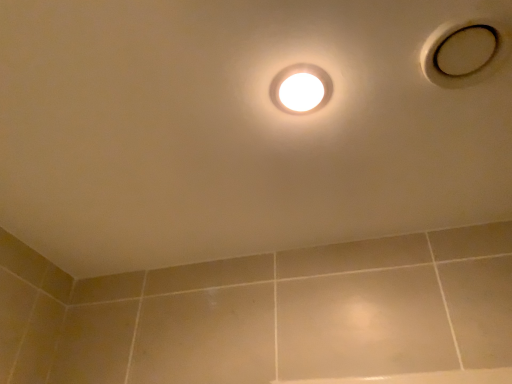
The image size is (512, 384). What are the coordinates of `white matte hole at upper right` in the screenshot? It's located at (463, 53).

The image size is (512, 384). What do you see at coordinates (463, 53) in the screenshot?
I see `white matte hole at upper right` at bounding box center [463, 53].

What is the approximate height of white matte hole at upper right?

The height of white matte hole at upper right is 1.03 inches.

Measure the distance between white glossy droplight at center and camera.

white glossy droplight at center is 26.93 inches away from camera.

In order to click on white glossy droplight at center in this screenshot , I will do `click(301, 89)`.

What do you see at coordinates (301, 89) in the screenshot? I see `white glossy droplight at center` at bounding box center [301, 89].

This screenshot has width=512, height=384. Find the location of `white matte hole at upper right`. white matte hole at upper right is located at coordinates (463, 53).

Is white glossy droplight at center at the left side of white matte hole at upper right?

Yes, white glossy droplight at center is to the left of white matte hole at upper right.

Relative to white matte hole at upper right, is white glossy droplight at center in front or behind?

In the image, white glossy droplight at center appears behind white matte hole at upper right.

Does point (279, 85) appear closer or farther from the camera than point (459, 74)?

Point (279, 85) appears to be farther away from the viewer than point (459, 74).

From the image's perspective, which is above, white glossy droplight at center or white matte hole at upper right?

From the image's view, white matte hole at upper right is above.

From a real-world perspective, who is located lower, white glossy droplight at center or white matte hole at upper right?

From a 3D spatial view, white glossy droplight at center is below.

Looking at their sizes, would you say white glossy droplight at center is wider or thinner than white matte hole at upper right?

Considering their sizes, white glossy droplight at center looks slimmer than white matte hole at upper right.

Is white glossy droplight at center taller than white matte hole at upper right?

No.

Based on their sizes in the image, would you say white glossy droplight at center is bigger or smaller than white matte hole at upper right?

white glossy droplight at center is smaller than white matte hole at upper right.

Is white glossy droplight at center positioned beyond the bounds of white matte hole at upper right?

Yes, white glossy droplight at center is located beyond the bounds of white matte hole at upper right.

From the picture: Is the surface of white glossy droplight at center in direct contact with white matte hole at upper right?

white glossy droplight at center is not next to white matte hole at upper right, and they're not touching.

Does white glossy droplight at center turn towards white matte hole at upper right?

No, white glossy droplight at center is not facing towards white matte hole at upper right.

Can you tell me how much white glossy droplight at center and white matte hole at upper right differ in facing direction?

2.21 degrees.

At what (x,y) coordinates should I click in order to perform the action: click on droplight below the white matte hole at upper right (from the image's perspective). Please return your answer as a coordinate pair (x, y). The height and width of the screenshot is (384, 512). Looking at the image, I should click on (301, 89).

Considering the relative positions of white matte hole at upper right and white glossy droplight at center in the image provided, is white matte hole at upper right to the left of white glossy droplight at center from the viewer's perspective?

In fact, white matte hole at upper right is to the right of white glossy droplight at center.

Consider the image. Which object is more forward, white matte hole at upper right or white glossy droplight at center?

white matte hole at upper right is more forward.

Considering the positions of points (463, 42) and (284, 71), is point (463, 42) farther from camera compared to point (284, 71)?

No, it is in front of (284, 71).

Looking at this image, from the image's perspective, is white matte hole at upper right above or below white glossy droplight at center?

From the image's perspective, white matte hole at upper right appears above white glossy droplight at center.

From a real-world perspective, which object stands above the other?

white matte hole at upper right.

Can you confirm if white matte hole at upper right is thinner than white glossy droplight at center?

No.

Considering the sizes of white matte hole at upper right and white glossy droplight at center in the image, is white matte hole at upper right taller or shorter than white glossy droplight at center?

white matte hole at upper right is taller than white glossy droplight at center.

Based on the photo, who is smaller, white matte hole at upper right or white glossy droplight at center?

white glossy droplight at center.

Is white matte hole at upper right completely or partially outside of white glossy droplight at center?

Indeed, white matte hole at upper right is completely outside white glossy droplight at center.

Is white matte hole at upper right with white glossy droplight at center?

No, white matte hole at upper right is not in contact with white glossy droplight at center.

Does white matte hole at upper right turn towards white glossy droplight at center?

No, white matte hole at upper right is not oriented towards white glossy droplight at center.

How different are the orientations of white matte hole at upper right and white glossy droplight at center in degrees?

2.21 degrees separate the facing orientations of white matte hole at upper right and white glossy droplight at center.

Where is `droplight behind the white matte hole at upper right`? The image size is (512, 384). droplight behind the white matte hole at upper right is located at coordinates (301, 89).

Locate an element on the screen. droplight below the white matte hole at upper right (from the image's perspective) is located at coordinates (301, 89).

Identify the location of hole on the right side of white glossy droplight at center. The height and width of the screenshot is (384, 512). (463, 53).